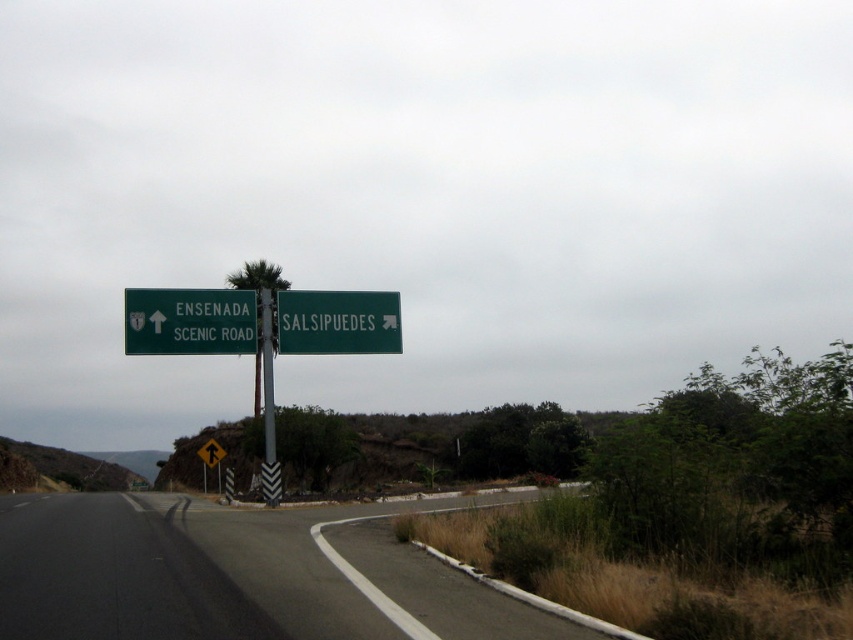
You are a self driving car navigating the road scene. You need to stay on the black asphalt road at center. What coordinate should your GPS lock onto to ensure you stay on the road?

The black asphalt road at center is located at coordinate point [241,573]. Your GPS should lock onto this coordinate to stay on the road.

You are driving on a road and see the green matte sign at upper left and the green leafy palm tree at center. Which object is closer to the right edge of the road?

The green matte sign at upper left is positioned on the right side of the green leafy palm tree at center, so it is closer to the right edge of the road.

You are driving along the road and see the green matte sign at upper left and the green leafy palm tree at center. Which object is closer to you?

The green matte sign at upper left is closer to you because the green leafy palm tree at center is behind it.